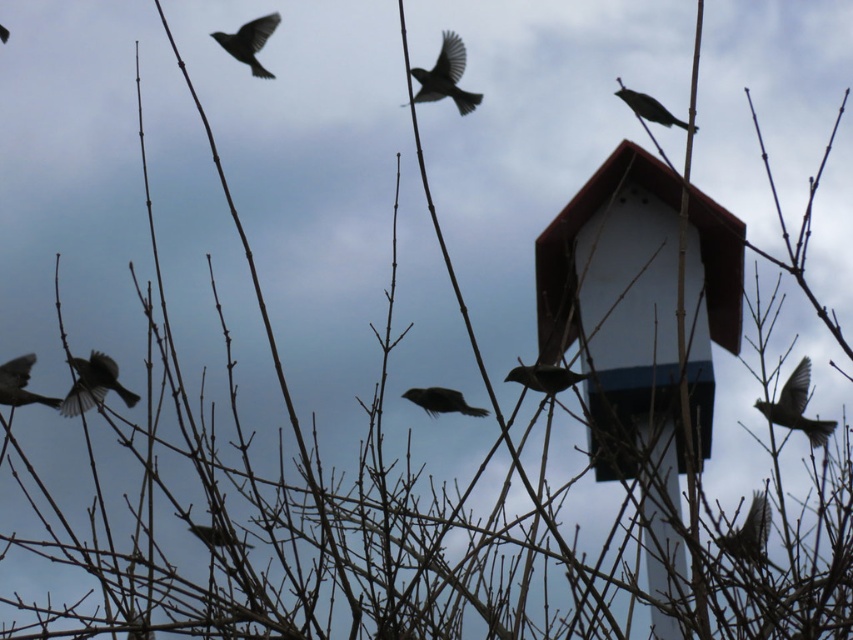
Question: Can you confirm if gray feathered bird at right is smaller than silvery metallic bird at lower center?

Choices:
 (A) no
 (B) yes

Answer: (B)

Question: Which point is farther to the camera?

Choices:
 (A) dark gray feathers at center
 (B) silvery gray feathers at upper left

Answer: (B)

Question: Estimate the real-world distances between objects in this image. Which object is farther from the silvery gray feathers at upper left?

Choices:
 (A) silvery metallic bird at lower right
 (B) dark gray feathers at left
 (C) brown feathered bird at center

Answer: (A)

Question: Is dark gray feathers at center to the left of silvery gray feathers at upper left from the viewer's perspective?

Choices:
 (A) no
 (B) yes

Answer: (A)

Question: Which of the following is the farthest from the observer?

Choices:
 (A) matte gray bird at left
 (B) brown feathered bird at center
 (C) silvery metallic bird at lower right

Answer: (A)

Question: Is silvery metallic bird at lower right positioned in front of brown feathered bird at center?

Choices:
 (A) no
 (B) yes

Answer: (B)